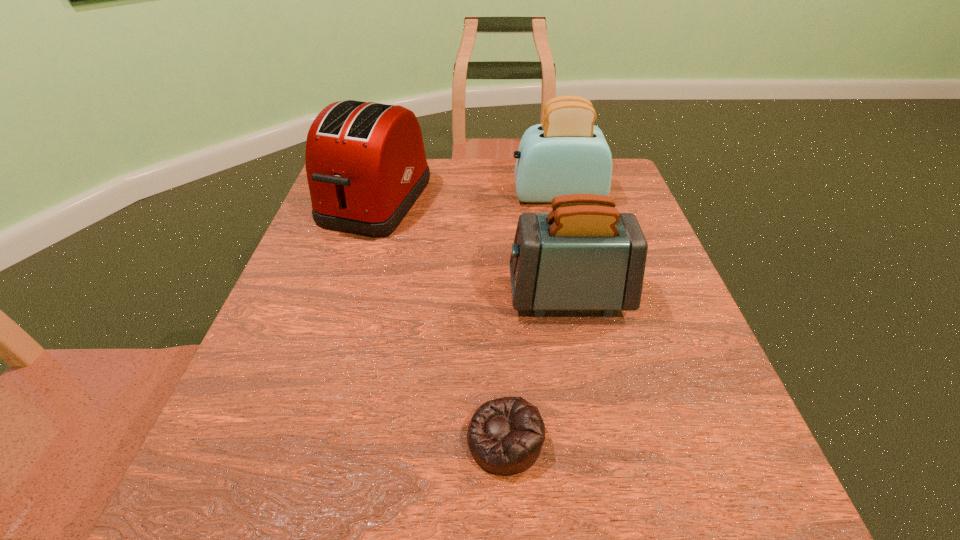
Identify the location of the leftmost object. The width and height of the screenshot is (960, 540). (366, 166).

Identify the location of the third farthest object. This screenshot has width=960, height=540. (584, 255).

Where is `the shortest object`? This screenshot has width=960, height=540. the shortest object is located at coordinates click(x=505, y=436).

At what (x,y) coordinates should I click in order to perform the action: click on beanbag. Please return your answer as a coordinate pair (x, y). Image resolution: width=960 pixels, height=540 pixels. Looking at the image, I should click on (505, 436).

Locate an element on the screen. The image size is (960, 540). vacant region located on the right of the leftmost object is located at coordinates (463, 201).

Identify the location of vacant region located 0.330m on the front-facing side of the second nearest object. (342, 296).

Identify the location of vacant space located 0.320m on the front-facing side of the second nearest object. (348, 296).

The width and height of the screenshot is (960, 540). Identify the location of vacant space located on the front-facing side of the second nearest object. (438, 296).

Identify the location of vacant space located on the back of the shortest object. (499, 307).

In order to click on object situated at the near edge in this screenshot , I will do `click(505, 436)`.